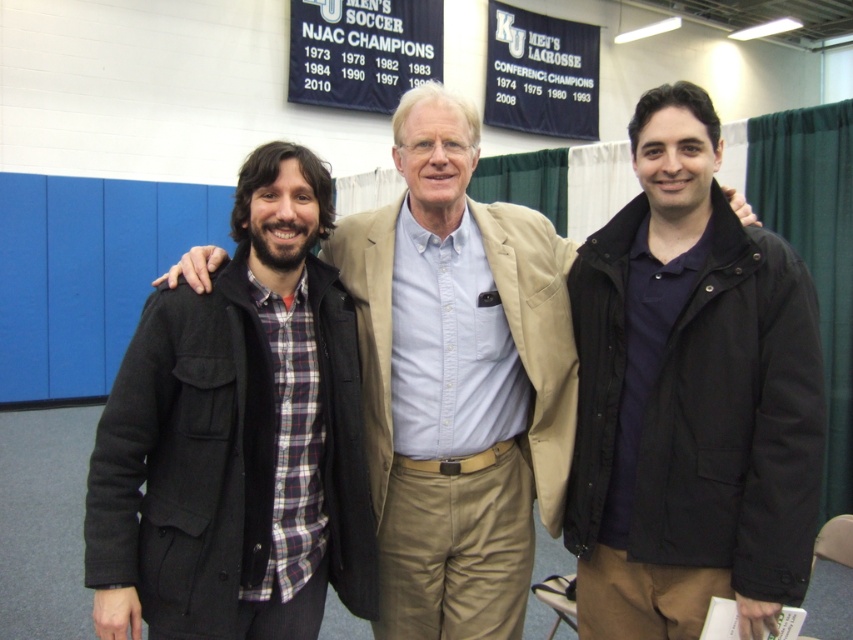
The height and width of the screenshot is (640, 853). Describe the element at coordinates (689, 397) in the screenshot. I see `black matte jacket at right` at that location.

Is the position of black matte jacket at right more distant than that of matte black coat at left?

A: Yes, black matte jacket at right is behind matte black coat at left.

Image resolution: width=853 pixels, height=640 pixels. Identify the location of black matte jacket at right. (689, 397).

This screenshot has height=640, width=853. What are the coordinates of `black matte jacket at right` in the screenshot? It's located at (689, 397).

Is black matte jacket at right shorter than plaid shirt at center?

Correct, black matte jacket at right is not as tall as plaid shirt at center.

Who is more forward, (689, 620) or (511, 433)?

Positioned in front is point (689, 620).

Identify the location of black matte jacket at right. (x=689, y=397).

Does matte black coat at left lie behind plaid shirt at center?

No, it is in front of plaid shirt at center.

Is matte black coat at left taller than plaid shirt at center?

No, matte black coat at left is not taller than plaid shirt at center.

Which is behind, point (265, 611) or point (392, 307)?

Positioned behind is point (392, 307).

Identify the location of matte black coat at left. This screenshot has height=640, width=853. [238, 436].